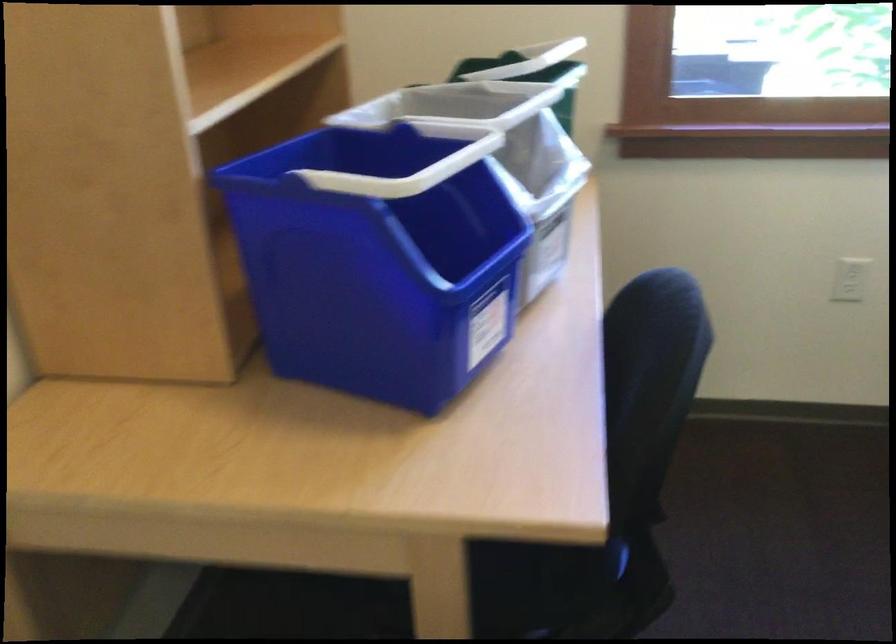
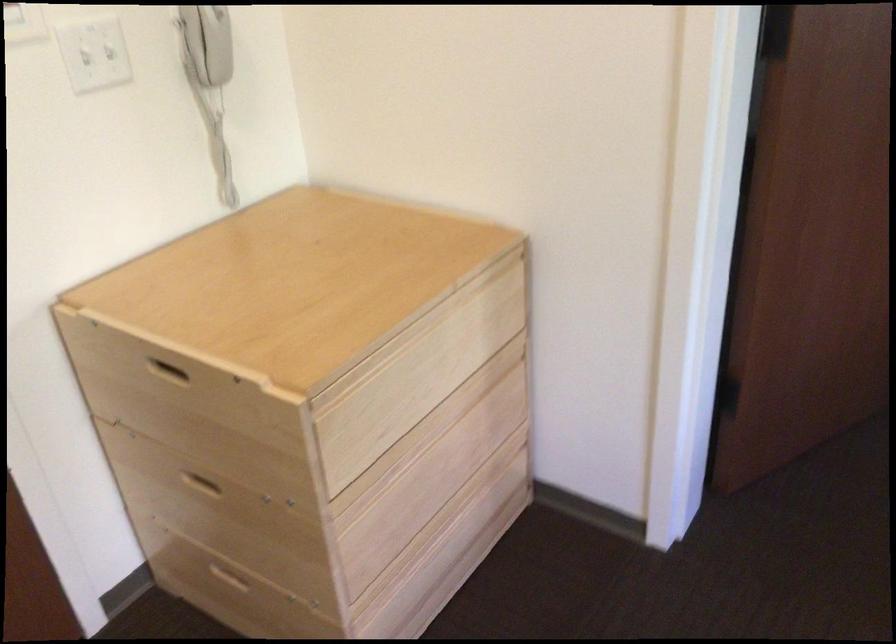
First-person continuous shooting, in which direction is the camera rotating?

The rotation direction of the camera is left-down.